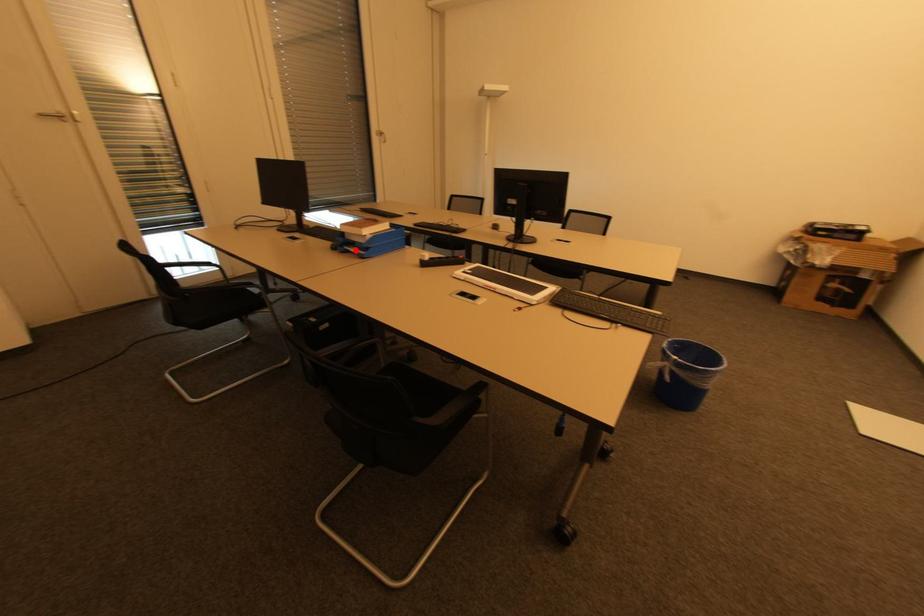
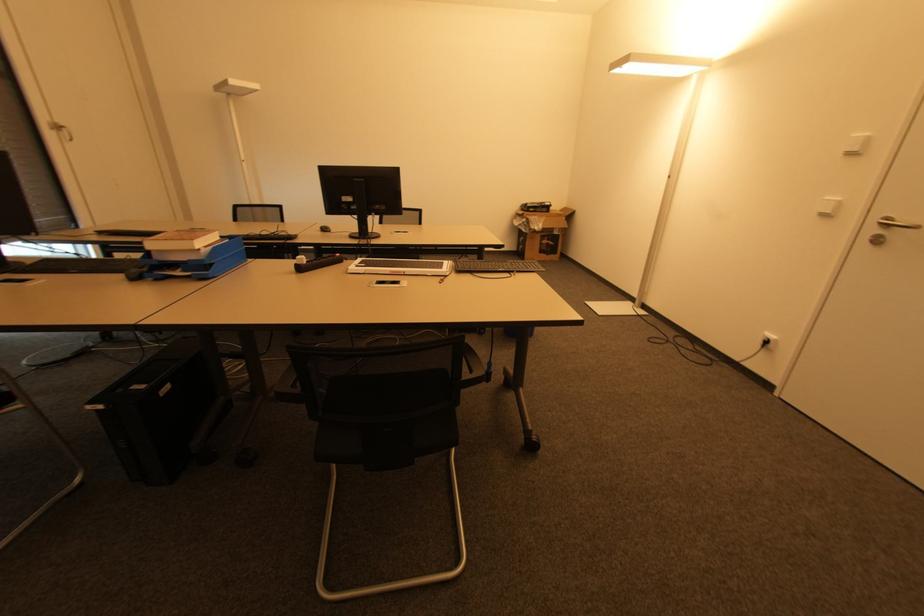
Where in the second image is the point corresponding to the highlighted location from the first image?

(178, 274)